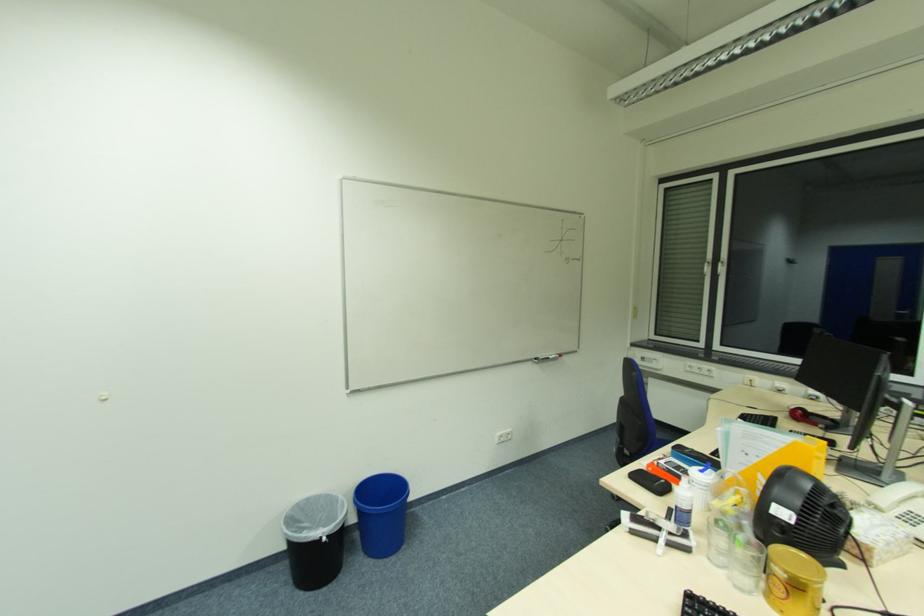
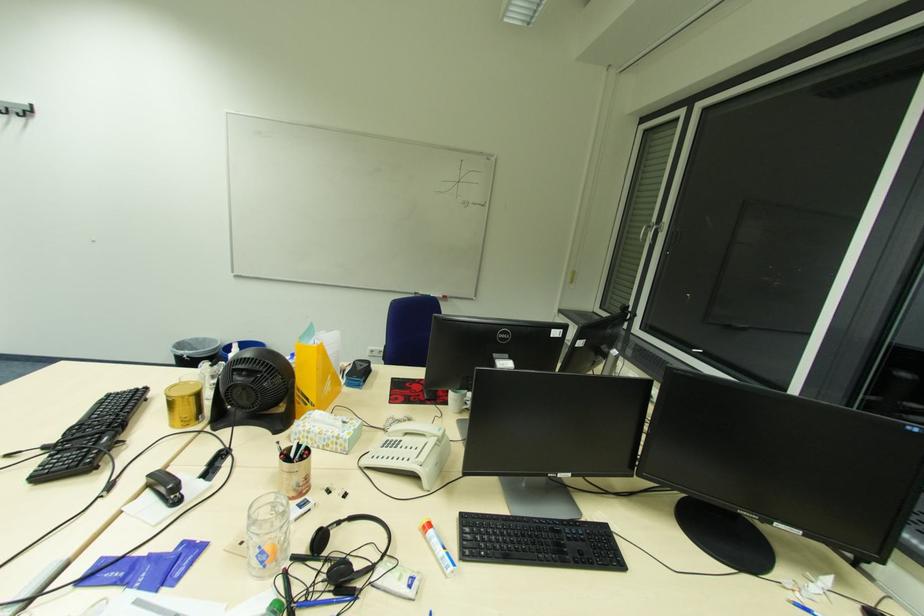
Question: Which direction would the cameraman need to move to produce the second image? Reply with the corresponding letter.

Choices:
 (A) Left
 (B) Right
 (C) Forward
 (D) Backward

Answer: (B)